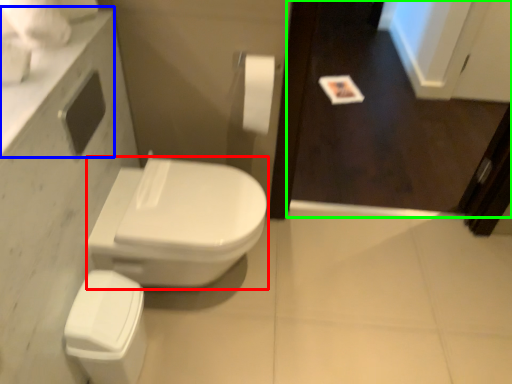
Question: Based on their relative distances, which object is nearer to bidet (highlighted by a red box)? Choose from counter top (highlighted by a blue box) and screen door (highlighted by a green box).

Choices:
 (A) counter top
 (B) screen door

Answer: (A)